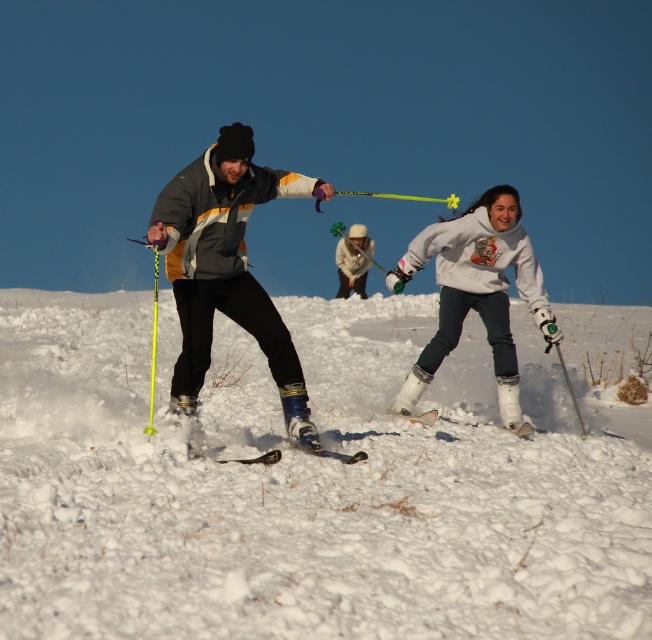
You are a photographer standing at the edge of the snowy slope. You want to take a photo of the white fluffy snow at center and the white matte snowboarder at center. If your camera has a maximum focus range of 4 meters, will both subjects be in focus?

The white fluffy snow at center and white matte snowboarder at center are 4.11 meters apart. Since the camera can only focus within 4 meters, the distance between them exceeds the focus range. Therefore, both subjects cannot be in focus simultaneously.

You are a photographer trying to capture a clear photo of the white matte snowboarder at center and the black matte ski at center. Since you want to focus on the larger subject, which one should you prioritize in your composition?

The white matte snowboarder at center is bigger than the black matte ski at center, so you should prioritize the white matte snowboarder at center in your composition to focus on the larger subject.